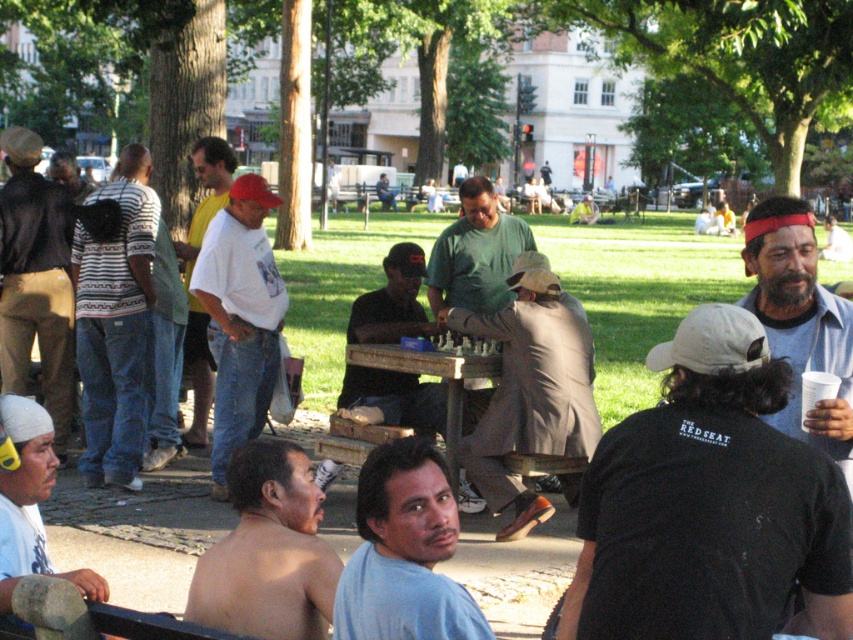
You are a photographer standing in the park and want to take a photo of the brown leather jacket at center and the striped shirt at left. Which one is positioned lower in the image?

The brown leather jacket at center is located below the striped shirt at left, so it is positioned lower in the image.

You are a photographer trying to capture a group photo of the people around the chessboard. You need to ensure that both the brown leather jacket at center and the striped shirt at left are fully visible in the frame. Based on their positions and sizes, do you think you can fit both into the camera view without cropping either of them?

The brown leather jacket at center might be wider than striped shirt at left, so you should position the camera to include the wider brown leather jacket at center first, ensuring the striped shirt at left also stays within the frame.

You are planning to place a small decorative item on the table in the park scene. The item is exactly the same width as the matte brown cap at center. Will it fit on the wooden picnic table at center without overhanging?

The matte brown cap at center is narrower than the wooden picnic table at center, so the decorative item with the same width as the matte brown cap at center will fit on the wooden picnic table at center without overhanging.